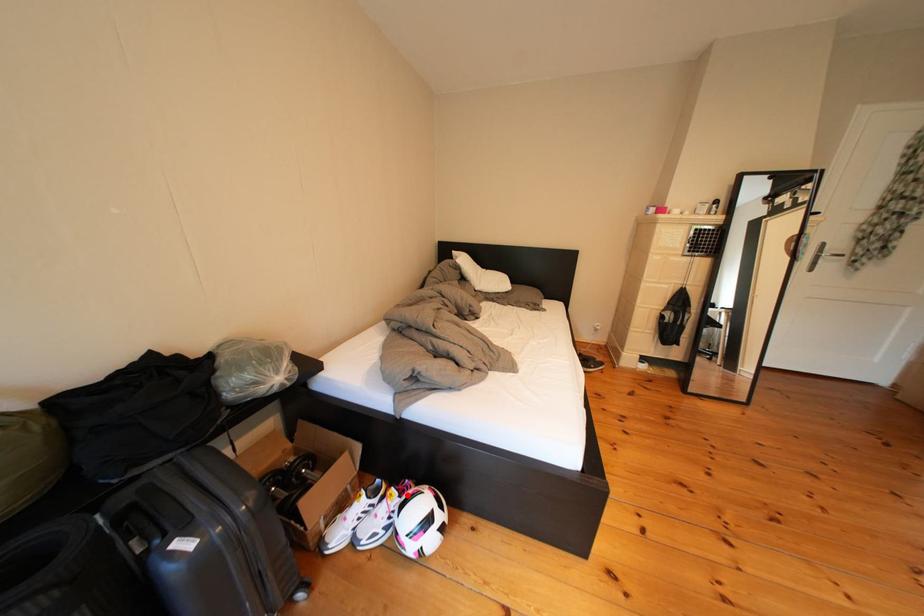
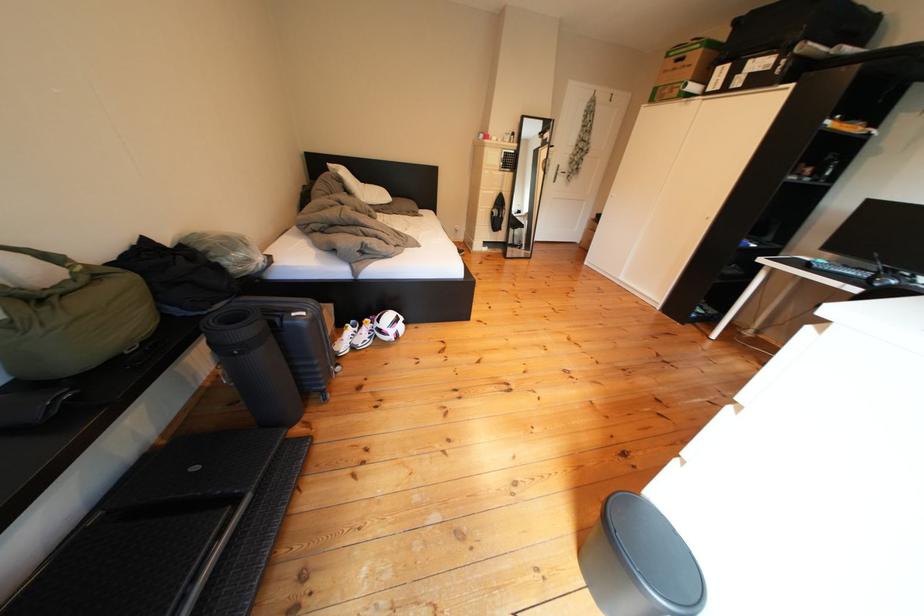
Find the pixel in the second image that matches the highlighted location in the first image.

(381, 325)